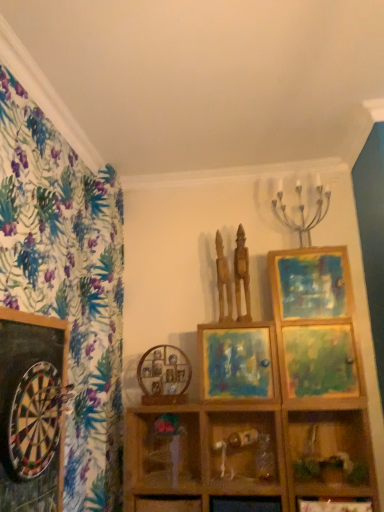
Question: Looking at their shapes, would you say wooden vase at center is wider or thinner than matte wooden picture frame at center, arranged as the 2th picture frame when viewed from the front?

Choices:
 (A) thin
 (B) wide

Answer: (A)

Question: Is wooden vase at center in front of or behind matte wooden picture frame at center, the 3th picture frame positioned from the left, in the image?

Choices:
 (A) behind
 (B) front

Answer: (B)

Question: Estimate the real-world distances between objects in this image. Which object is farther from the wooden statue at upper center, marked as the 2th sculpture in a left-to-right arrangement?

Choices:
 (A) wooden figurine at center, which is counted as the second shelf, starting from the left
 (B) wooden statue at upper center, arranged as the 1th sculpture when viewed from the left
 (C) wooden picture frame at center, which is the first picture frame in back-to-front order
 (D) matte wooden picture frame at center, arranged as the 2th picture frame when viewed from the front
 (E) wooden at center, arranged as the 3th shelf when viewed from the right

Answer: (E)

Question: Based on their relative distances, which object is nearer to the wooden picture frame at center, which ranks as the 2th picture frame in left-to-right order?

Choices:
 (A) wooden dartboard at left, positioned as the 1th picture frame in front-to-back order
 (B) wooden statue at upper center, the 1th sculpture viewed from the right
 (C) wooden vase at center
 (D) metallic silver candle holder at upper right
 (E) wooden shelf at lower right, marked as the third shelf in a left-to-right arrangement

Answer: (C)